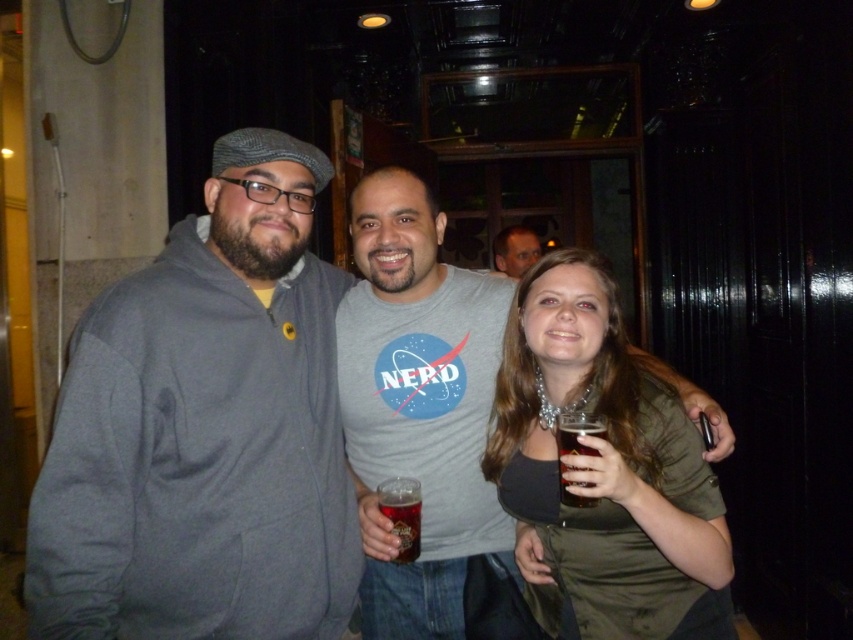
You are a photographer trying to capture the perfect shot of the green matte shirt at center and the translucent glass mug at center. Based on their positions, which object should you focus on first if you want to ensure both are in focus without adjusting your camera settings?

The green matte shirt at center is above the translucent glass mug at center, so focusing on the green matte shirt at center first will ensure both are in focus since it is closer to the camera.

You are a photographer at the event and need to ensure that the green matte shirt at center and the translucent glass mug at center are both visible in the photo. Given that the shirt is wider than the mug, which object should you focus on to capture both without cropping either?

Since the green matte shirt at center is wider than the translucent glass mug at center, you should focus on the green matte shirt at center to ensure both are fully visible without cropping, as it requires more space.

You are a photographer at the event and want to take a photo of the brown glass at center without the gray fleece jacket at left blocking it. What should you do?

Move to the side so that the gray fleece jacket at left is no longer in front of the brown glass at center.